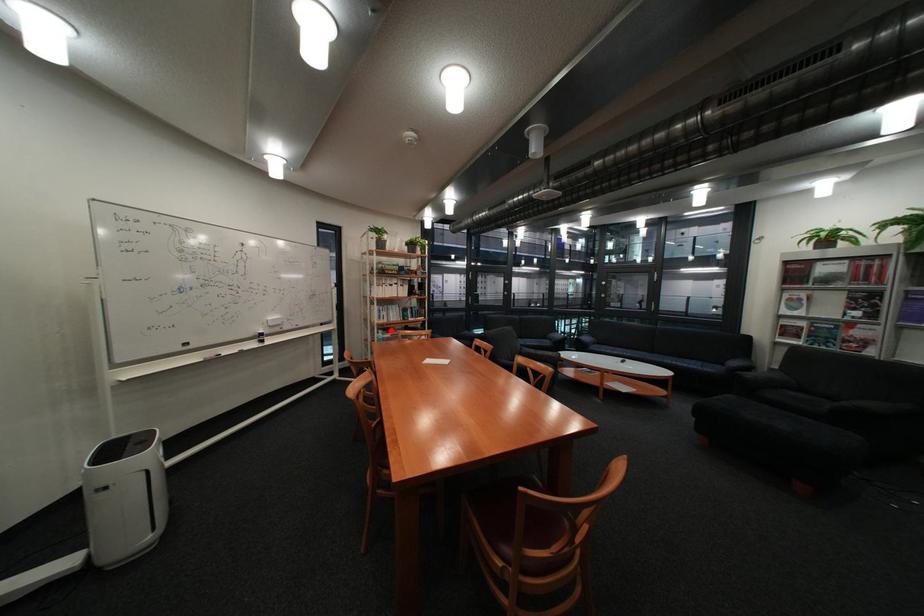
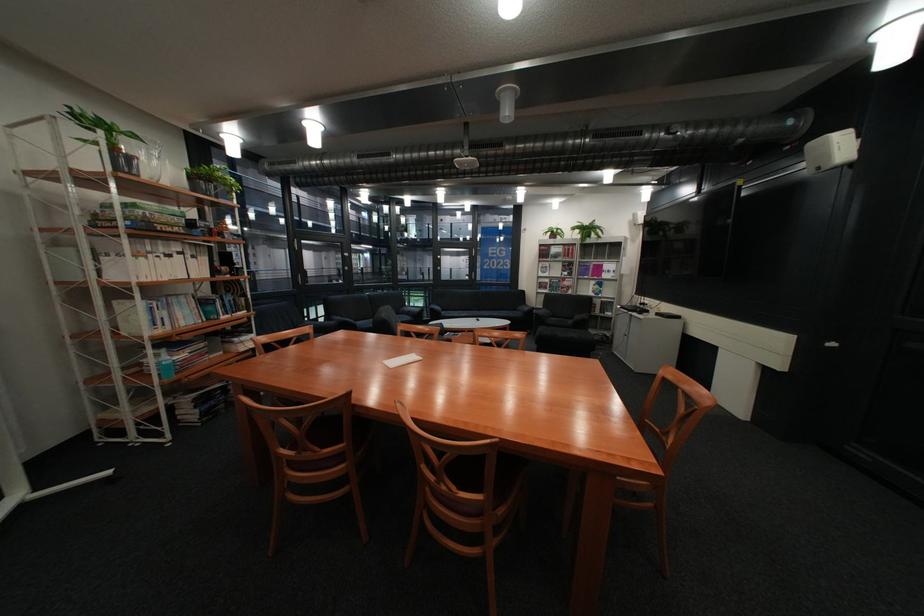
Where in the second image is the point corresponding to the highlighted location from the first image?

(165, 351)